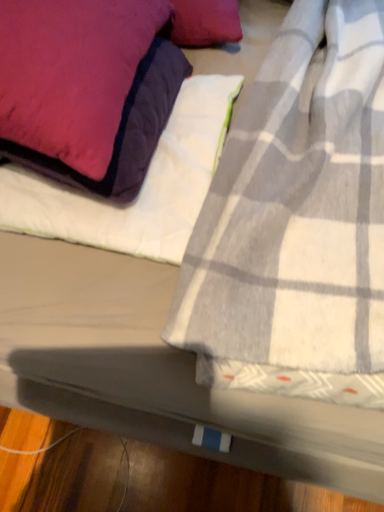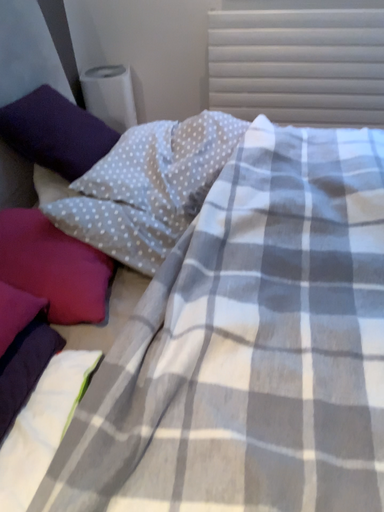
Question: Which way did the camera rotate in the video?

Choices:
 (A) rotated upward
 (B) rotated downward

Answer: (A)